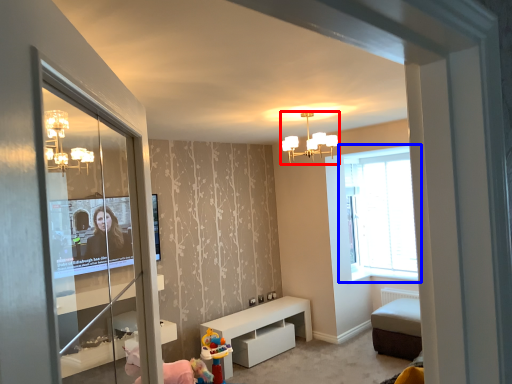
Question: Which object is further to the camera taking this photo, light fixture (highlighted by a red box) or window (highlighted by a blue box)?

Choices:
 (A) light fixture
 (B) window

Answer: (B)